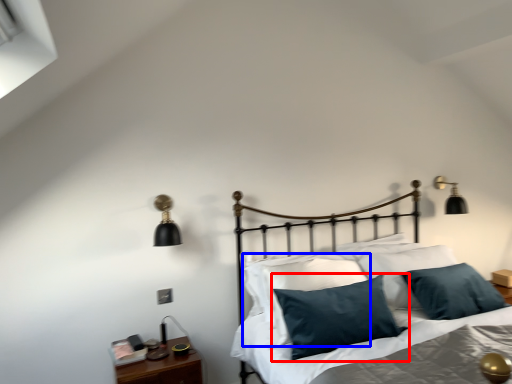
Question: Which of the following is the farthest to the observer, pillow (highlighted by a red box) or pillow (highlighted by a blue box)?

Choices:
 (A) pillow
 (B) pillow

Answer: (B)